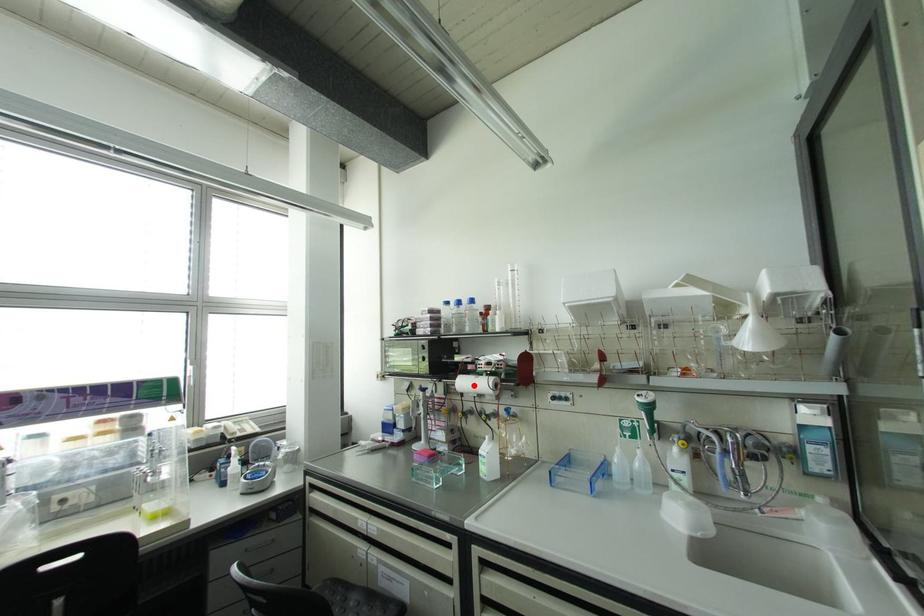
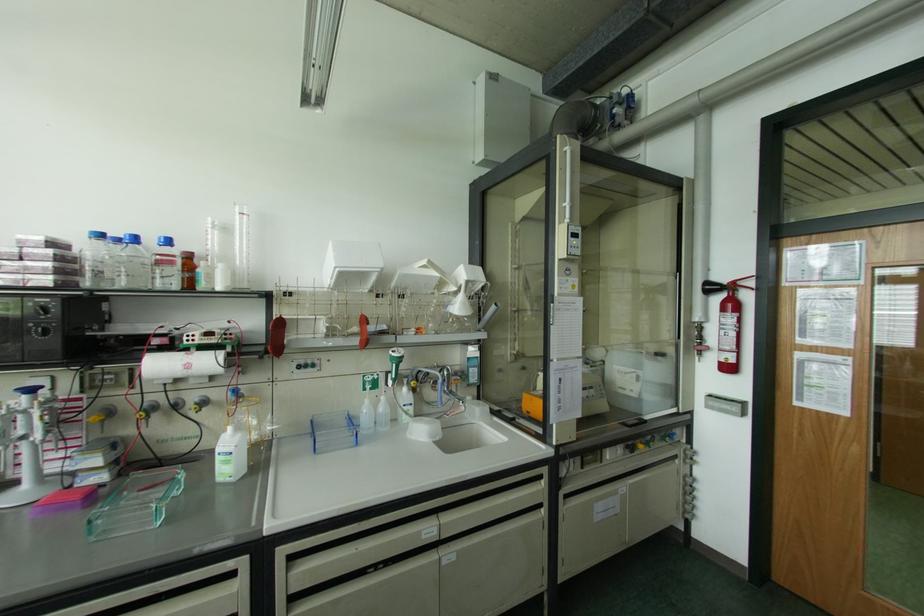
Question: I am providing you with two images of the same scene from different viewpoints. A red point is marked on the first image. At the location where the point appears in image 1, is it still visible in image 2?

Choices:
 (A) Yes
 (B) No

Answer: (A)